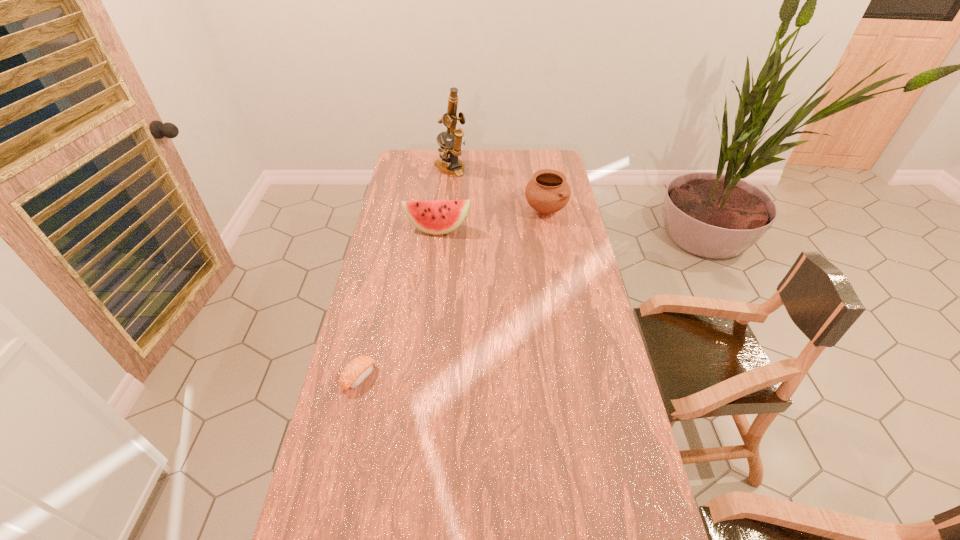
The width and height of the screenshot is (960, 540). I want to click on microscope, so click(450, 150).

You are a GUI agent. You are given a task and a screenshot of the screen. Output one action in this format:
    pyautogui.click(x=<x>, y=<y>)
    Task: Click on the tallest object
    The width and height of the screenshot is (960, 540).
    Given the screenshot: What is the action you would take?
    pyautogui.click(x=450, y=150)

At what (x,y) coordinates should I click in order to perform the action: click on the rightmost object. Please return your answer as a coordinate pair (x, y). This screenshot has width=960, height=540. Looking at the image, I should click on (548, 192).

The image size is (960, 540). What are the coordinates of `watermelon` in the screenshot? It's located at (437, 217).

Locate an element on the screen. The width and height of the screenshot is (960, 540). sushi is located at coordinates (355, 372).

The image size is (960, 540). What are the coordinates of `the nearest object` in the screenshot? It's located at (355, 372).

You are a GUI agent. You are given a task and a screenshot of the screen. Output one action in this format:
    pyautogui.click(x=<x>, y=<y>)
    Task: Click on the vacant region located on the front of the farthest object
    This screenshot has width=960, height=540.
    Given the screenshot: What is the action you would take?
    pyautogui.click(x=448, y=191)

Find the location of a particular element. free location located on the left of the rightmost object is located at coordinates (454, 208).

Locate an element on the screen. This screenshot has width=960, height=540. vacant region located 0.250m on the outer rind of the watermelon is located at coordinates (432, 281).

Locate an element on the screen. This screenshot has width=960, height=540. free space located on the right of the shortest object is located at coordinates (501, 377).